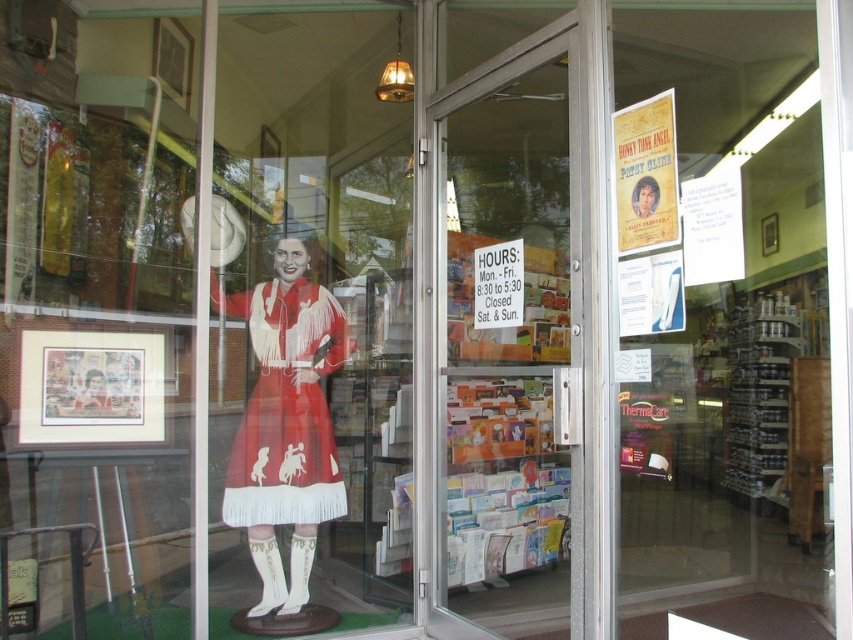
You are a delivery person trying to enter the store through the entrance. The white paper sign at center says the door is closed for maintenance. Can you open the transparent glass door at center to enter?

The transparent glass door at center is larger in size than the white paper sign at center, but the sign states the door is closed for maintenance. You cannot open the transparent glass door at center to enter because the sign indicates it is closed.

You are standing at the entrance of the store and want to enter. The transparent glass door at center is the only entrance. Can you walk through it?

Yes, you can walk through the transparent glass door at center since it is transparent and likely openable, allowing entry into the store.